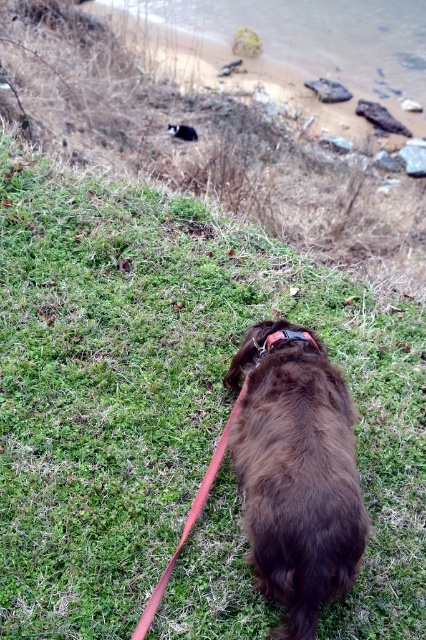
Which is behind, point (166, 582) or point (310, 337)?

The point (310, 337) is behind.

Who is shorter, red rubber leash at lower center or rubber/soft neckband at center?

rubber/soft neckband at center is shorter.

Locate an element on the screen. The image size is (426, 640). red rubber leash at lower center is located at coordinates (189, 518).

Where is `red rubber leash at lower center`? The height and width of the screenshot is (640, 426). red rubber leash at lower center is located at coordinates (189, 518).

How much distance is there between brown furry dog at center and red rubber leash at lower center?

brown furry dog at center is 13.46 inches from red rubber leash at lower center.

Looking at this image, does brown furry dog at center have a greater height compared to red rubber leash at lower center?

Indeed, brown furry dog at center has a greater height compared to red rubber leash at lower center.

Does point (284, 440) lie in front of point (166, 579)?

Yes, it is in front of point (166, 579).

Where is `brown furry dog at center`? The height and width of the screenshot is (640, 426). brown furry dog at center is located at coordinates (296, 476).

At what (x,y) coordinates should I click in order to perform the action: click on brown furry dog at center. Please return your answer as a coordinate pair (x, y). The width and height of the screenshot is (426, 640). Looking at the image, I should click on (296, 476).

The image size is (426, 640). What do you see at coordinates (296, 476) in the screenshot?
I see `brown furry dog at center` at bounding box center [296, 476].

At what (x,y) coordinates should I click in order to perform the action: click on brown furry dog at center. Please return your answer as a coordinate pair (x, y). This screenshot has width=426, height=640. Looking at the image, I should click on (296, 476).